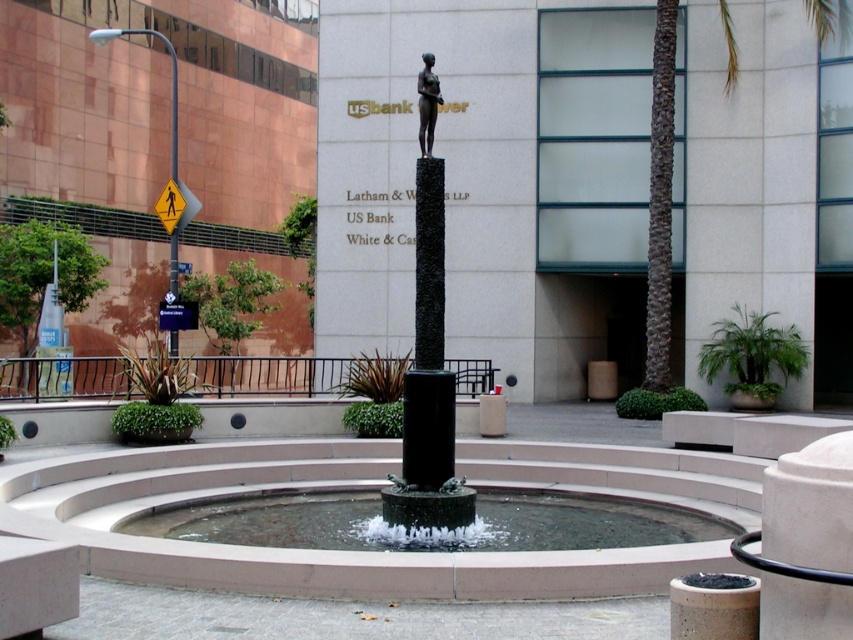
You are a delivery person needing to navigate from the yellow reflective plastic pedestrian sign at upper left to the bronze statue at center in the plaza. What is the approximate distance you need to cover?

The bronze statue at center is 30.36 feet from the yellow reflective plastic pedestrian sign at upper left, so the distance you need to cover is approximately 30.36 feet.

From the picture: You are a tourist in the plaza and want to take a photo of the bronze statue at center. However, there is a yellow reflective plastic pedestrian sign at upper left blocking your view. Can you determine if the statue is smaller than the sign?

The bronze statue at center is smaller than the yellow reflective plastic pedestrian sign at upper left, so the statue may be partially obscured by the sign in your photo.

You are standing in the plaza and want to take a photo of the bronze statue at center. The camera you have can focus on objects up to 10 meters away. Will the statue be in focus?

The bronze statue at center is 9.04 meters from camera, so yes, the statue will be in focus since it is within the camera focus range of up to 10 meters.